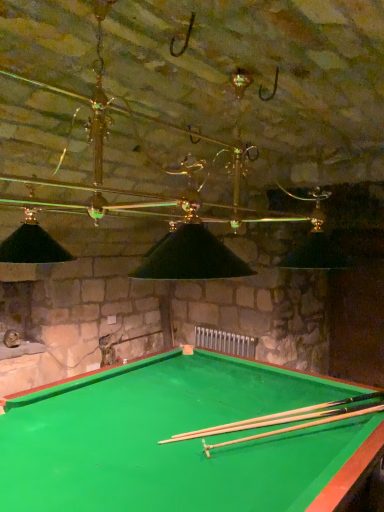
Image resolution: width=384 pixels, height=512 pixels. In order to click on free space above wooden cue at center (from a real-world perspective) in this screenshot , I will do `click(305, 411)`.